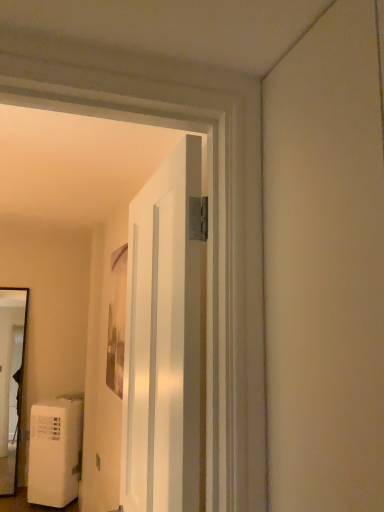
The image size is (384, 512). Identify the location of white glossy door at center. (164, 339).

Is matte wooden picture frame at center facing away from white glossy door at center?

matte wooden picture frame at center does not have its back to white glossy door at center.

From a real-world perspective, which object stands above the other?

In real-world perspective, matte wooden picture frame at center is above.

How far apart are matte wooden picture frame at center and white glossy door at center?

matte wooden picture frame at center and white glossy door at center are 5.28 feet apart from each other.

Consider the image. Considering the positions of objects white glossy door at center and white matte water heater at lower left in the image provided, who is in front, white glossy door at center or white matte water heater at lower left?

Positioned in front is white glossy door at center.

Can you confirm if white glossy door at center is positioned to the right of white matte water heater at lower left?

Yes, white glossy door at center is to the right of white matte water heater at lower left.

Based on the photo, considering the sizes of white glossy door at center and white matte water heater at lower left in the image, is white glossy door at center wider or thinner than white matte water heater at lower left?

white glossy door at center is thinner than white matte water heater at lower left.

Considering the sizes of objects white glossy door at center and white matte water heater at lower left in the image provided, who is taller, white glossy door at center or white matte water heater at lower left?

Standing taller between the two is white glossy door at center.

Is white matte water heater at lower left in contact with white glossy door at center?

There is a gap between white matte water heater at lower left and white glossy door at center.

From a real-world perspective, is white matte water heater at lower left under white glossy door at center?

Yes, from a real-world perspective, white matte water heater at lower left is under white glossy door at center.

Does white matte water heater at lower left turn towards white glossy door at center?

No, white matte water heater at lower left is not aimed at white glossy door at center.

Does matte wooden picture frame at center have a greater height compared to white matte water heater at lower left?

Yes, matte wooden picture frame at center is taller than white matte water heater at lower left.

In the scene shown: From the image's perspective, is matte wooden picture frame at center located above white matte water heater at lower left?

Correct, matte wooden picture frame at center appears higher than white matte water heater at lower left in the image.

Considering the positions of points (112, 343) and (43, 415), is point (112, 343) farther from camera compared to point (43, 415)?

No, (112, 343) is closer to viewer.

Can you confirm if matte wooden picture frame at center is smaller than white matte water heater at lower left?

Yes, matte wooden picture frame at center is smaller than white matte water heater at lower left.

From the image's perspective, which object appears higher, white matte water heater at lower left or matte wooden picture frame at center?

From the image's view, matte wooden picture frame at center is above.

Considering the relative sizes of white matte water heater at lower left and matte wooden picture frame at center in the image provided, is white matte water heater at lower left bigger than matte wooden picture frame at center?

Yes, white matte water heater at lower left is bigger than matte wooden picture frame at center.

Considering the relative sizes of white matte water heater at lower left and matte wooden picture frame at center in the image provided, is white matte water heater at lower left taller than matte wooden picture frame at center?

In fact, white matte water heater at lower left may be shorter than matte wooden picture frame at center.

Is white glossy door at center positioned with its back to matte wooden picture frame at center?

white glossy door at center does not have its back to matte wooden picture frame at center.

Does white glossy door at center touch matte wooden picture frame at center?

No, white glossy door at center is not with matte wooden picture frame at center.

You are a GUI agent. You are given a task and a screenshot of the screen. Output one action in this format:
    pyautogui.click(x=<x>, y=<y>)
    Task: Click on the picture frame that appears above the white glossy door at center (from a real-world perspective)
    Image resolution: width=384 pixels, height=512 pixels.
    Given the screenshot: What is the action you would take?
    point(117,321)

Considering the relative positions of white glossy door at center and matte wooden picture frame at center in the image provided, is white glossy door at center to the right of matte wooden picture frame at center from the viewer's perspective?

Yes.

Find the location of a particular element. picture frame above the white glossy door at center (from a real-world perspective) is located at coordinates (117, 321).

Identify the location of door that appears on the right of white matte water heater at lower left. (164, 339).

From the image, which object appears to be nearer to matte wooden picture frame at center, white glossy door at center or white matte water heater at lower left?

white matte water heater at lower left.

When comparing their distances from white matte water heater at lower left, does white glossy door at center or matte wooden picture frame at center seem closer?

Among the two, matte wooden picture frame at center is located nearer to white matte water heater at lower left.

When comparing their distances from white glossy door at center, does matte wooden picture frame at center or white matte water heater at lower left seem further?

Based on the image, white matte water heater at lower left appears to be further to white glossy door at center.

When comparing their distances from white matte water heater at lower left, does matte wooden picture frame at center or white glossy door at center seem further?

white glossy door at center.

Based on their spatial positions, is white matte water heater at lower left or matte wooden picture frame at center further from white glossy door at center?

white matte water heater at lower left lies further to white glossy door at center than the other object.

Based on their spatial positions, is white matte water heater at lower left or white glossy door at center closer to matte wooden picture frame at center?

The object closer to matte wooden picture frame at center is white matte water heater at lower left.

This screenshot has width=384, height=512. I want to click on picture frame between white glossy door at center and white matte water heater at lower left from front to back, so click(117, 321).